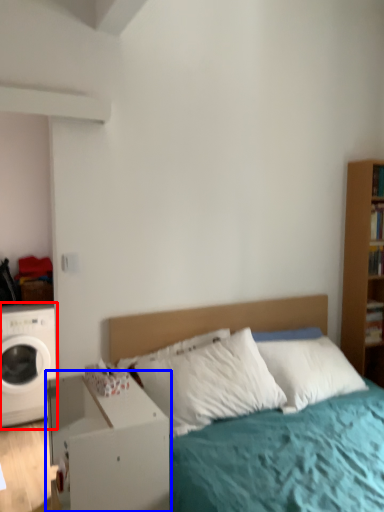
Question: Which object is closer to the camera taking this photo, washing machine (highlighted by a red box) or nightstand (highlighted by a blue box)?

Choices:
 (A) washing machine
 (B) nightstand

Answer: (B)